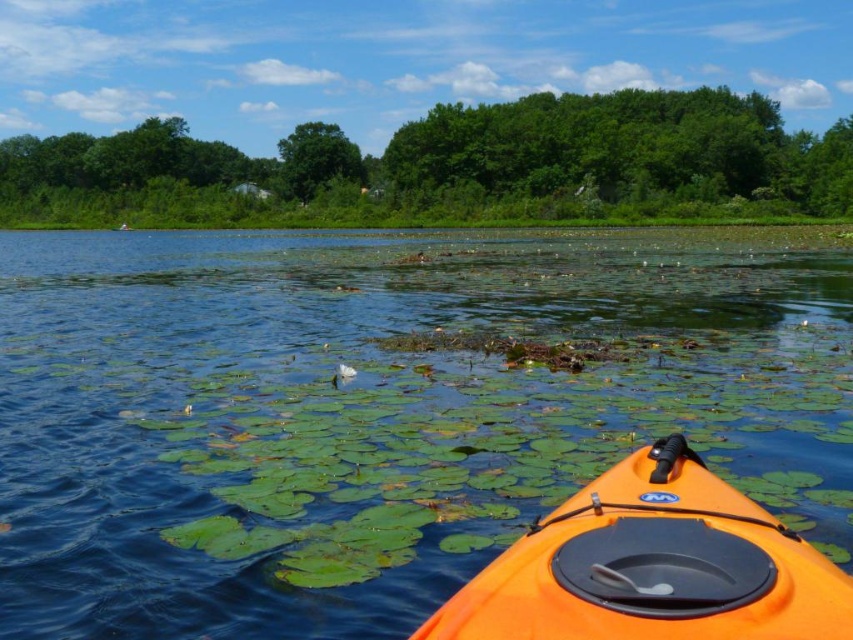
Question: Which point is farther from the camera taking this photo?

Choices:
 (A) (194, 314)
 (B) (587, 499)

Answer: (A)

Question: Which object appears closest to the camera in this image?

Choices:
 (A) transparent water at center
 (B) orange matte kayak at lower right

Answer: (B)

Question: Can you confirm if transparent water at center is bigger than orange matte kayak at lower right?

Choices:
 (A) no
 (B) yes

Answer: (B)

Question: Is transparent water at center positioned in front of orange matte kayak at lower right?

Choices:
 (A) no
 (B) yes

Answer: (A)

Question: Among these objects, which one is farthest from the camera?

Choices:
 (A) transparent water at center
 (B) orange matte kayak at lower right

Answer: (A)

Question: Can you confirm if transparent water at center is positioned below orange matte kayak at lower right?

Choices:
 (A) yes
 (B) no

Answer: (B)